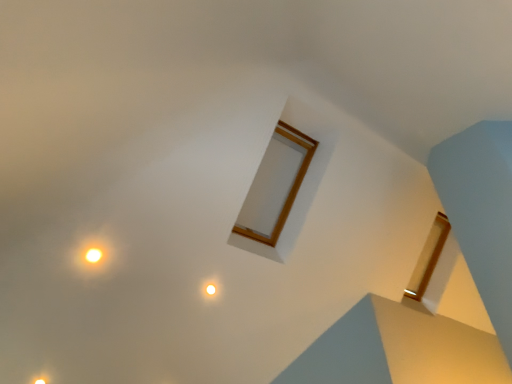
At what (x,y) coordinates should I click in order to perform the action: click on yellow matte light at upper left, which is the 1th light from front to back. Please return your answer as a coordinate pair (x, y). The height and width of the screenshot is (384, 512). Looking at the image, I should click on (94, 255).

Identify the location of matte yellow light at lower left, which is the 3th light from top to bottom. This screenshot has height=384, width=512. (41, 380).

This screenshot has width=512, height=384. Describe the element at coordinates (41, 380) in the screenshot. I see `matte yellow light at lower left, which appears as the second light when viewed from the back` at that location.

The width and height of the screenshot is (512, 384). Identify the location of matte white light at center, arranged as the 2th light when viewed from the top. (210, 289).

In order to click on yellow matte light at upper left, which is the 1th light from front to back in this screenshot , I will do point(94,255).

Locate an element on the screen. Image resolution: width=512 pixels, height=384 pixels. the 1st light behind the yellow matte light at upper left, the second light positioned from the left, counting from the anchor's position is located at coordinates (41, 380).

Could you tell me if matte yellow light at lower left, which appears as the second light when viewed from the front, is facing yellow matte light at upper left, acting as the 1th light starting from the top?

No, matte yellow light at lower left, which appears as the second light when viewed from the front, is not facing towards yellow matte light at upper left, acting as the 1th light starting from the top.

Which of these two, matte yellow light at lower left, the first light in the bottom-to-top sequence, or yellow matte light at upper left, the second light viewed from the right, is wider?

Wider between the two is yellow matte light at upper left, the second light viewed from the right.

Considering the sizes of objects matte yellow light at lower left, which is the 3th light from right to left, and yellow matte light at upper left, which is the 1th light from front to back, in the image provided, who is bigger, matte yellow light at lower left, which is the 3th light from right to left, or yellow matte light at upper left, which is the 1th light from front to back,?

Bigger between the two is yellow matte light at upper left, which is the 1th light from front to back.

Based on the photo, would you consider yellow matte light at upper left, the second light positioned from the left, to be distant from matte yellow light at lower left, the first light in the bottom-to-top sequence?

No, there isn't a large distance between yellow matte light at upper left, the second light positioned from the left, and matte yellow light at lower left, the first light in the bottom-to-top sequence.

Based on the photo, from the image's perspective, would you say yellow matte light at upper left, which is the 1th light from front to back, is positioned over matte yellow light at lower left, which appears as the second light when viewed from the back?

Yes.

At what (x,y) coordinates should I click in order to perform the action: click on light on the left of yellow matte light at upper left, which is the 1th light from front to back. Please return your answer as a coordinate pair (x, y). Image resolution: width=512 pixels, height=384 pixels. Looking at the image, I should click on (41, 380).

From the yellow matte light at upper left, which is the 1th light from front to back, count 2nd lights backward and point to it. Please provide its 2D coordinates.

[(210, 289)]

Considering the sizes of objects matte white light at center, acting as the third light starting from the front, and yellow matte light at upper left, the second light viewed from the right, in the image provided, who is wider, matte white light at center, acting as the third light starting from the front, or yellow matte light at upper left, the second light viewed from the right,?

yellow matte light at upper left, the second light viewed from the right, is wider.

Is matte white light at center, the 2th light from the bottom, touching yellow matte light at upper left, the second light viewed from the right?

No, matte white light at center, the 2th light from the bottom, is not making contact with yellow matte light at upper left, the second light viewed from the right.

Does matte white light at center, arranged as the 2th light when viewed from the top, appear on the right side of yellow matte light at upper left, the second light viewed from the right?

Indeed, matte white light at center, arranged as the 2th light when viewed from the top, is positioned on the right side of yellow matte light at upper left, the second light viewed from the right.

Is yellow matte light at upper left, acting as the 1th light starting from the top, in contact with matte white light at center, which is counted as the first light, starting from the right?

No, yellow matte light at upper left, acting as the 1th light starting from the top, is not making contact with matte white light at center, which is counted as the first light, starting from the right.

Is yellow matte light at upper left, acting as the 1th light starting from the top, positioned with its back to matte white light at center, which is counted as the first light, starting from the right?

yellow matte light at upper left, acting as the 1th light starting from the top, is not turned away from matte white light at center, which is counted as the first light, starting from the right.

Image resolution: width=512 pixels, height=384 pixels. What are the coordinates of `light that is the 2nd one when counting forward from the matte white light at center, acting as the third light starting from the front` in the screenshot? It's located at pyautogui.click(x=94, y=255).

Can you confirm if yellow matte light at upper left, the second light viewed from the right, is bigger than matte white light at center, the 2th light from the bottom?

Yes, yellow matte light at upper left, the second light viewed from the right, is bigger than matte white light at center, the 2th light from the bottom.

The height and width of the screenshot is (384, 512). There is a matte yellow light at lower left, which appears as the second light when viewed from the back. Identify the location of the 1st light above it (from the image's perspective). (210, 289).

From a real-world perspective, which object rests below the other?

From a 3D spatial view, matte yellow light at lower left, marked as the 1th light in a left-to-right arrangement, is below.

Is matte white light at center, the third light positioned from the left, facing away from matte yellow light at lower left, which appears as the second light when viewed from the back?

No, matte white light at center, the third light positioned from the left, is not facing away from matte yellow light at lower left, which appears as the second light when viewed from the back.

Measure the distance from matte white light at center, the third light positioned from the left, to matte yellow light at lower left, which appears as the second light when viewed from the front.

A distance of 1.35 meters exists between matte white light at center, the third light positioned from the left, and matte yellow light at lower left, which appears as the second light when viewed from the front.

Locate an element on the screen. the 1st light in front of the matte white light at center, the 1th light viewed from the back, counting from the anchor's position is located at coordinates (41, 380).

Does matte yellow light at lower left, marked as the 1th light in a left-to-right arrangement, have a smaller size compared to matte white light at center, the 2th light from the bottom?

Actually, matte yellow light at lower left, marked as the 1th light in a left-to-right arrangement, might be larger than matte white light at center, the 2th light from the bottom.

From a real-world perspective, which is physically above, matte yellow light at lower left, which appears as the second light when viewed from the back, or matte white light at center, which is counted as the first light, starting from the right?

In real-world perspective, matte white light at center, which is counted as the first light, starting from the right, is above.

Would you say matte yellow light at lower left, which appears as the second light when viewed from the back, is to the left or to the right of matte white light at center, the 1th light viewed from the back, in the picture?

In the image, matte yellow light at lower left, which appears as the second light when viewed from the back, appears on the left side of matte white light at center, the 1th light viewed from the back.

At what (x,y) coordinates should I click in order to perform the action: click on light lying in front of the matte yellow light at lower left, marked as the 1th light in a left-to-right arrangement. Please return your answer as a coordinate pair (x, y). The image size is (512, 384). Looking at the image, I should click on (94, 255).

Image resolution: width=512 pixels, height=384 pixels. Identify the location of light on the left side of yellow matte light at upper left, acting as the 3th light starting from the back. point(41,380).

Estimate the real-world distances between objects in this image. Which object is further from matte yellow light at lower left, which is the 3th light from top to bottom, yellow matte light at upper left, the second light positioned from the left, or matte white light at center, which is counted as the first light, starting from the right?

matte white light at center, which is counted as the first light, starting from the right, lies further to matte yellow light at lower left, which is the 3th light from top to bottom, than the other object.

From the image, which object appears to be nearer to matte white light at center, the third light positioned from the left, yellow matte light at upper left, the second light viewed from the right, or matte yellow light at lower left, which appears as the second light when viewed from the front?

yellow matte light at upper left, the second light viewed from the right, is closer to matte white light at center, the third light positioned from the left.

Estimate the real-world distances between objects in this image. Which object is further from yellow matte light at upper left, acting as the 3th light starting from the back, matte white light at center, the third light positioned from the left, or matte yellow light at lower left, which is the 3th light from top to bottom?

The object further to yellow matte light at upper left, acting as the 3th light starting from the back, is matte yellow light at lower left, which is the 3th light from top to bottom.

When comparing their distances from yellow matte light at upper left, positioned as the 3th light in bottom-to-top order, does matte yellow light at lower left, which appears as the second light when viewed from the back, or matte white light at center, arranged as the 2th light when viewed from the top, seem closer?

matte white light at center, arranged as the 2th light when viewed from the top, is positioned closer to the anchor yellow matte light at upper left, positioned as the 3th light in bottom-to-top order.

Looking at the image, which one is located closer to matte white light at center, acting as the third light starting from the front, matte yellow light at lower left, which is the 3th light from top to bottom, or yellow matte light at upper left, acting as the 3th light starting from the back?

Based on the image, yellow matte light at upper left, acting as the 3th light starting from the back, appears to be nearer to matte white light at center, acting as the third light starting from the front.

Looking at this image, looking at the image, which one is located further to matte yellow light at lower left, which appears as the second light when viewed from the front, matte white light at center, the third light positioned from the left, or yellow matte light at upper left, which is the 1th light from front to back?

matte white light at center, the third light positioned from the left, is further to matte yellow light at lower left, which appears as the second light when viewed from the front.

Find the location of a particular element. light located between matte yellow light at lower left, which is the 3th light from right to left, and matte white light at center, the 1th light viewed from the back, in the left-right direction is located at coordinates (94, 255).